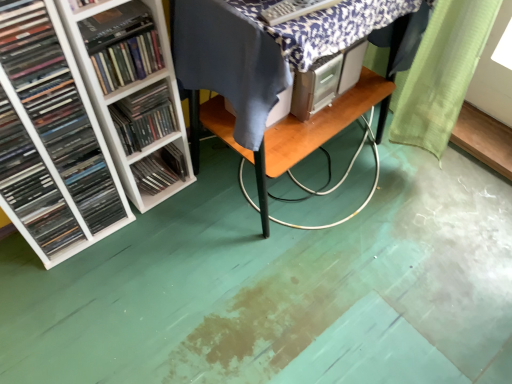
In order to click on free space in front of white plastic shelf at left, marked as the second shelf in a front-to-back arrangement in this screenshot , I will do `click(148, 222)`.